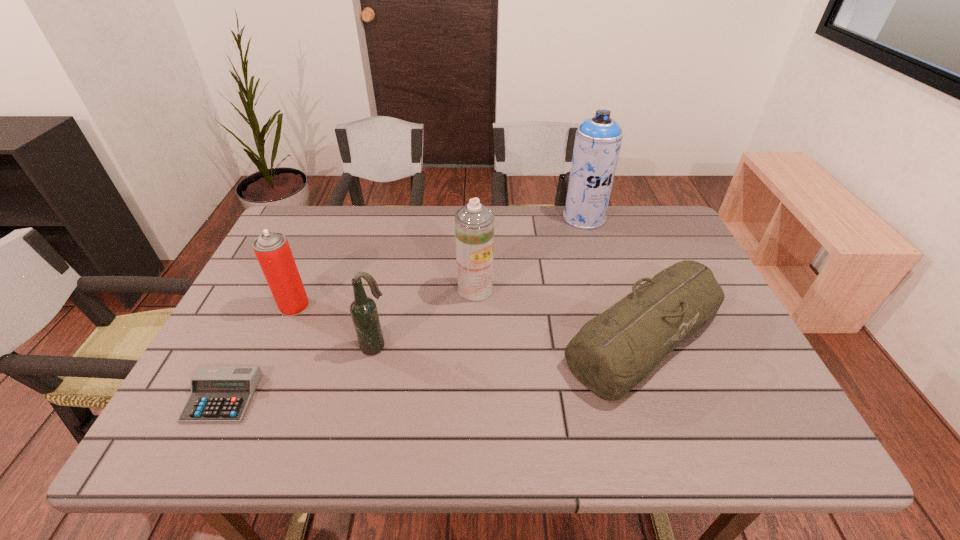
I want to click on blank space at the left edge of the desktop, so click(274, 341).

In the image, there is a desktop. At what (x,y) coordinates should I click in order to perform the action: click on blank space at the right edge. Please return your answer as a coordinate pair (x, y). This screenshot has width=960, height=540. Looking at the image, I should click on (712, 387).

This screenshot has height=540, width=960. Identify the location of vacant position at the near left corner of the desktop. (185, 436).

Find the location of a particular element. The width and height of the screenshot is (960, 540). vacant space at the far right corner is located at coordinates (658, 227).

Where is `free spot between the leftmost aerosol can and the third object from left to right`? free spot between the leftmost aerosol can and the third object from left to right is located at coordinates (335, 326).

What are the coordinates of `free area in between the shortest object and the fourth object from left to right` in the screenshot? It's located at (348, 343).

Image resolution: width=960 pixels, height=540 pixels. What are the coordinates of `free point between the second aerosol can from left to right and the fourth object from right to left` in the screenshot? It's located at (425, 318).

This screenshot has width=960, height=540. Find the location of `vacant space that is in between the shortest aerosol can and the shortest object`. vacant space that is in between the shortest aerosol can and the shortest object is located at coordinates click(x=258, y=352).

Image resolution: width=960 pixels, height=540 pixels. I want to click on free space that is in between the third object from right to left and the calculator, so click(x=348, y=343).

Where is `free space between the third object from right to left and the tallest object`? free space between the third object from right to left and the tallest object is located at coordinates (530, 253).